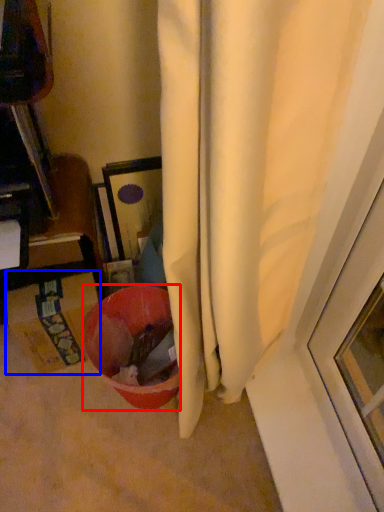
Question: Which point is further to the camera, bowl (highlighted by a red box) or cardboard box (highlighted by a blue box)?

Choices:
 (A) bowl
 (B) cardboard box

Answer: (B)